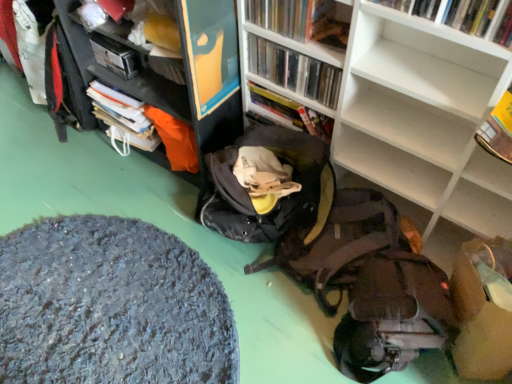
Question: Considering the relative sizes of textured gray rug at lower left and hardcover book at upper right, the 1th book when ordered from front to back, in the image provided, is textured gray rug at lower left wider than hardcover book at upper right, the 1th book when ordered from front to back,?

Choices:
 (A) no
 (B) yes

Answer: (B)

Question: From a real-world perspective, is textured gray rug at lower left beneath hardcover book at upper right, marked as the 4th book in a back-to-front arrangement?

Choices:
 (A) no
 (B) yes

Answer: (B)

Question: From a real-world perspective, is textured gray rug at lower left located higher than hardcover book at upper right, the 1th book when ordered from front to back?

Choices:
 (A) no
 (B) yes

Answer: (A)

Question: Could you tell me if textured gray rug at lower left is turned towards hardcover book at upper right, marked as the 4th book in a back-to-front arrangement?

Choices:
 (A) no
 (B) yes

Answer: (A)

Question: Is textured gray rug at lower left positioned in front of hardcover book at upper right, marked as the 4th book in a back-to-front arrangement?

Choices:
 (A) no
 (B) yes

Answer: (A)

Question: Considering the positions of hardcover book at upper left and white matte bookcase at center in the image, is hardcover book at upper left wider or thinner than white matte bookcase at center?

Choices:
 (A) wide
 (B) thin

Answer: (B)

Question: From a real-world perspective, is hardcover book at upper left physically located above or below white matte bookcase at center?

Choices:
 (A) below
 (B) above

Answer: (A)

Question: Visually, is hardcover book at upper left positioned to the left or to the right of white matte bookcase at center?

Choices:
 (A) right
 (B) left

Answer: (B)

Question: In terms of height, does hardcover book at upper left look taller or shorter compared to white matte bookcase at center?

Choices:
 (A) short
 (B) tall

Answer: (A)

Question: Considering the positions of point 284,51 and point 423,324, is point 284,51 closer or farther from the camera than point 423,324?

Choices:
 (A) closer
 (B) farther

Answer: (B)

Question: Based on their sizes in the image, would you say clear plastic case at upper center, arranged as the second book when viewed from the back, is bigger or smaller than matte brown backpack at lower right?

Choices:
 (A) big
 (B) small

Answer: (B)

Question: Considering the positions of clear plastic case at upper center, positioned as the 3th book in front-to-back order, and matte brown backpack at lower right in the image, is clear plastic case at upper center, positioned as the 3th book in front-to-back order, wider or thinner than matte brown backpack at lower right?

Choices:
 (A) wide
 (B) thin

Answer: (B)

Question: In the image, is clear plastic case at upper center, arranged as the second book when viewed from the back, on the left side or the right side of matte brown backpack at lower right?

Choices:
 (A) right
 (B) left

Answer: (B)

Question: Looking at their shapes, would you say white matte bookcase at center is wider or thinner than matte brown backpack at lower right?

Choices:
 (A) thin
 (B) wide

Answer: (A)

Question: Would you say white matte bookcase at center is to the left or to the right of matte brown backpack at lower right in the picture?

Choices:
 (A) right
 (B) left

Answer: (A)